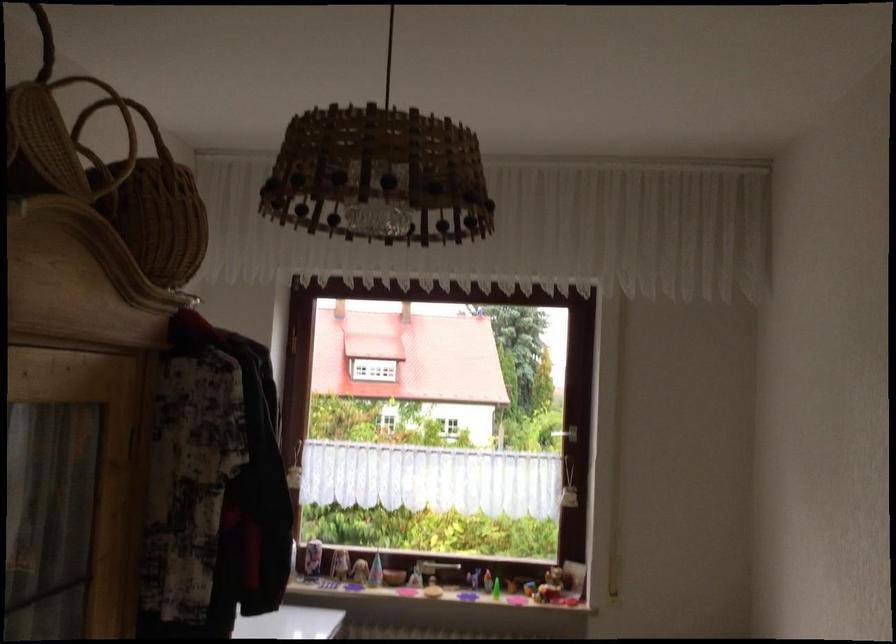
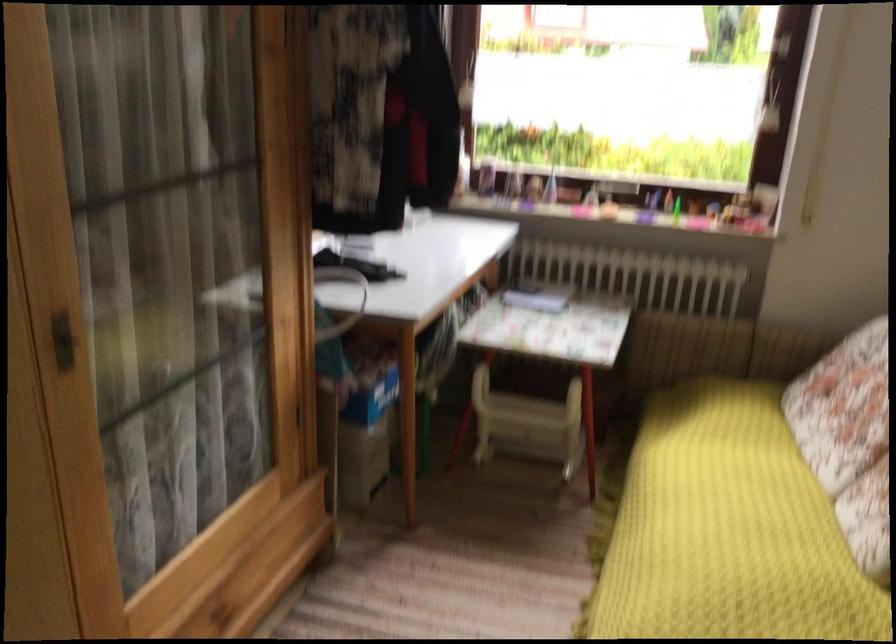
Question: Which direction would the cameraman need to move to produce the second image? Reply with the corresponding letter.

Choices:
 (A) Left
 (B) Right
 (C) Forward
 (D) Backward

Answer: (C)